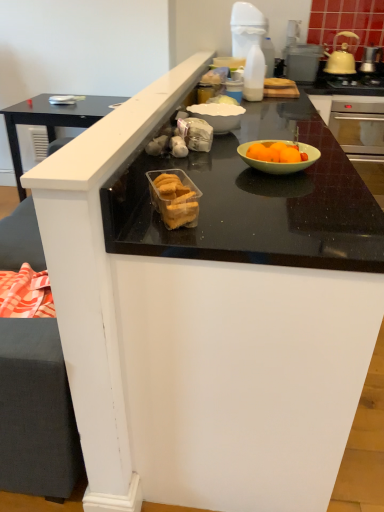
Question: From a real-world perspective, is yellow ceramic kettle at upper right above or below black glass gas stove at upper right?

Choices:
 (A) above
 (B) below

Answer: (A)

Question: Considering the positions of yellow ceramic kettle at upper right and black glass gas stove at upper right in the image, is yellow ceramic kettle at upper right wider or thinner than black glass gas stove at upper right?

Choices:
 (A) wide
 (B) thin

Answer: (B)

Question: Based on their relative distances, which object is farther from the metallic silver toaster at upper right?

Choices:
 (A) yellow ceramic kettle at upper right
 (B) translucent plastic container of cookies at center
 (C) black glass gas stove at upper right

Answer: (B)

Question: Considering the real-world distances, which object is closest to the translucent plastic container of cookies at center?

Choices:
 (A) black glass gas stove at upper right
 (B) metallic silver toaster at upper right
 (C) yellow ceramic kettle at upper right

Answer: (B)